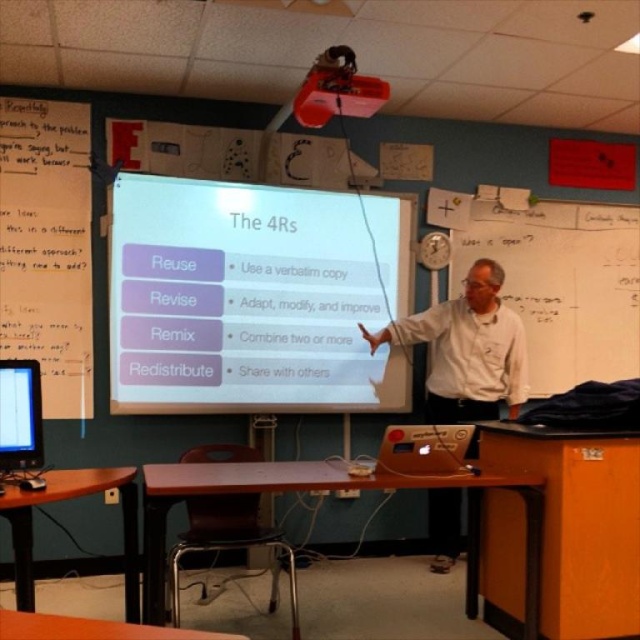
You are a student sitting in the classroom and want to compare the sizes of the white glossy projector screen at center and the black glossy screen at lower left. Based on their positions and sizes, which screen do you think is more likely to be the main presentation screen?

The white glossy projector screen at center is more likely to be the main presentation screen because its width is larger than the black glossy screen at lower left.

You are a student sitting in the classroom and want to take a photo of the projection screen. The teacher is standing at point (x=596, y=317) which is 4.40 meters from the camera. Will the teacher block your view of the projection screen when you take the photo?

The teacher is standing at point (x=596, y=317) which is 4.40 meters from the camera. Since the teacher is at that point, they are likely positioned between the camera and the projection screen, potentially blocking the view. However, the exact position depends on the screen distance. Without knowing the screen distance from the camera, we can only note the teacher is 4.40 meters away.